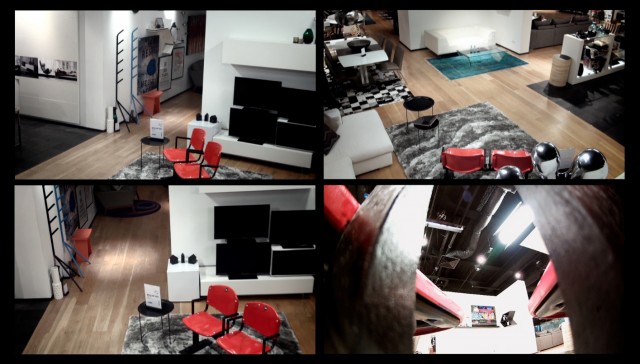
Locate an element on the screen. oak flooring is located at coordinates (502, 86).